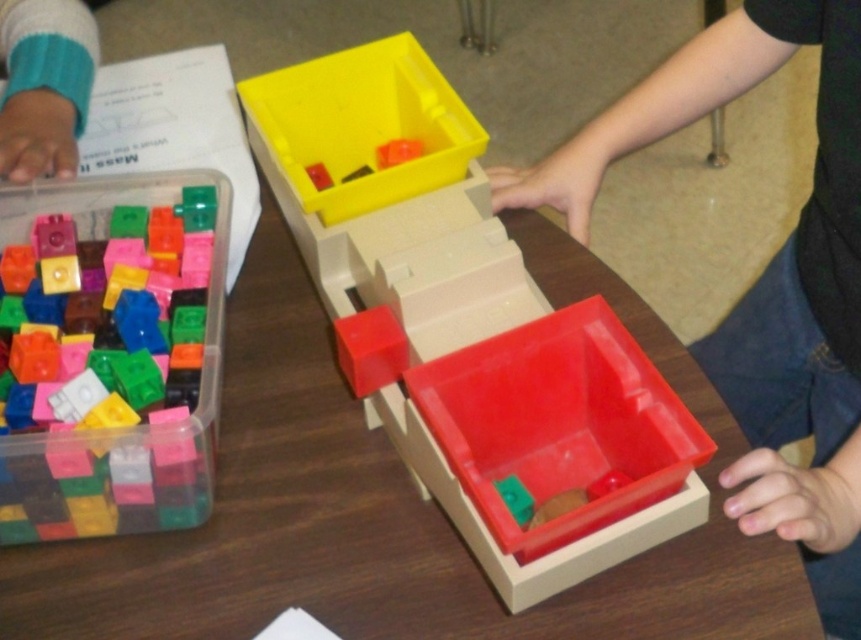
Question: Can you confirm if red plastic box at center is positioned above translucent plastic blocks at left?

Choices:
 (A) no
 (B) yes

Answer: (A)

Question: Which of the following is the farthest from the observer?

Choices:
 (A) (394, 144)
 (B) (29, 188)
 (C) (323, 122)

Answer: (C)

Question: In this image, where is yellow plastic box at upper center located relative to translucent plastic cube at upper center?

Choices:
 (A) right
 (B) left

Answer: (B)

Question: Which point appears closest to the camera in this image?

Choices:
 (A) (91, 449)
 (B) (381, 164)
 (C) (417, 77)

Answer: (A)

Question: Can you confirm if red plastic box at center is positioned below translucent plastic cube at upper center?

Choices:
 (A) yes
 (B) no

Answer: (A)

Question: Estimate the real-world distances between objects in this image. Which object is closer to the red plastic box at center?

Choices:
 (A) yellow plastic box at upper center
 (B) translucent plastic cube at upper center

Answer: (A)